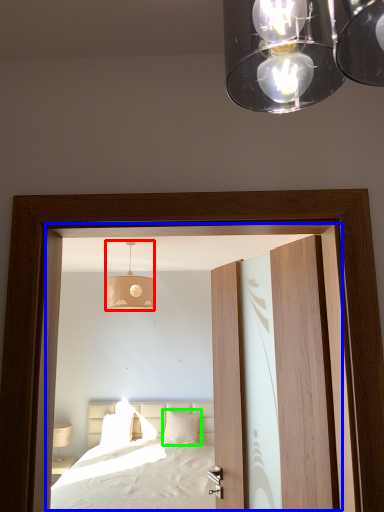
Question: Which is farther away from lamp (highlighted by a red box)? window (highlighted by a blue box) or pillow (highlighted by a green box)?

Choices:
 (A) window
 (B) pillow

Answer: (B)